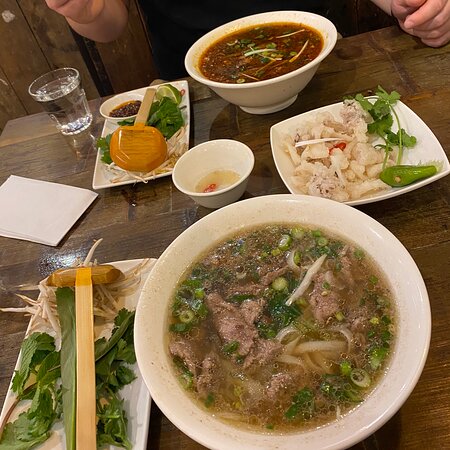
Find the location of a particular element. The image size is (450, 450). glass is located at coordinates 75,110.